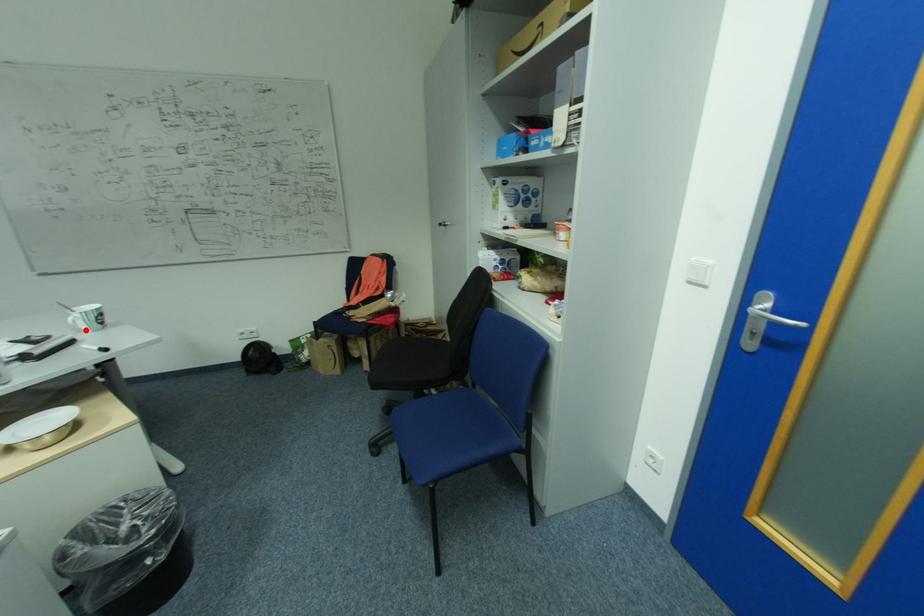
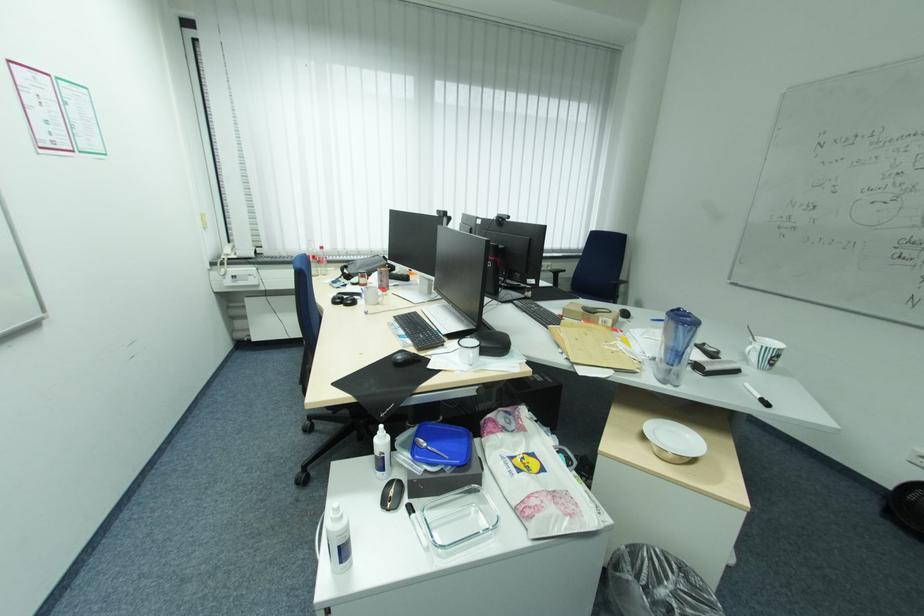
Question: I am providing you with two images of the same scene from different viewpoints. A red point is marked on the first image. Can you still see the location of the red point in image 2?

Choices:
 (A) Yes
 (B) No

Answer: (A)